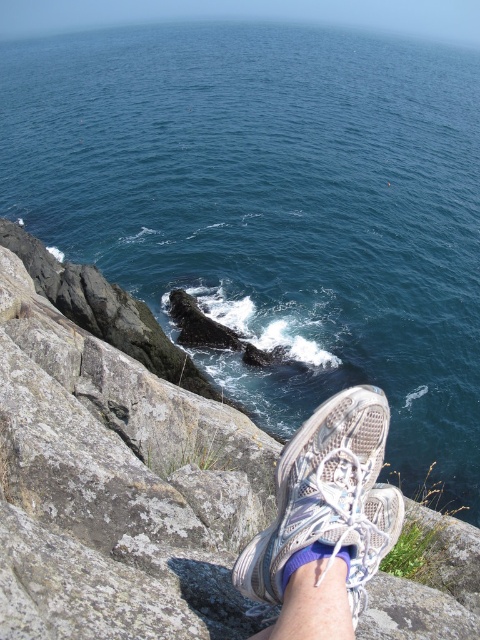
Can you confirm if gray rock cliff at lower left is thinner than white mesh shoe at lower center?

Incorrect, gray rock cliff at lower left's width is not less than white mesh shoe at lower center's.

Which of these two, gray rock cliff at lower left or white mesh shoe at lower center, stands shorter?

white mesh shoe at lower center

Between point (116, 541) and point (310, 429), which one is positioned behind?

Positioned behind is point (116, 541).

Locate an element on the screen. This screenshot has width=480, height=640. gray rock cliff at lower left is located at coordinates (113, 481).